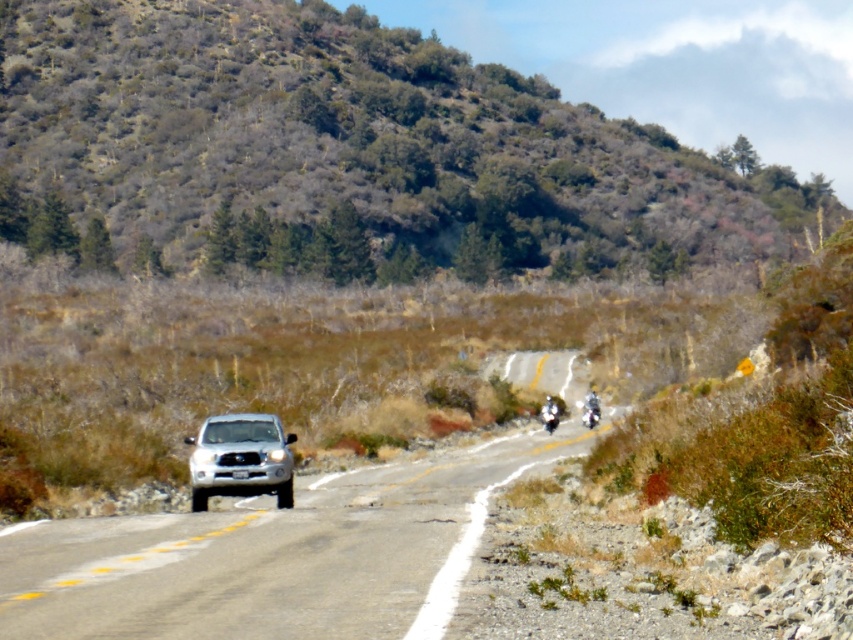
You are a cyclist approaching the road with two silver SUVs. You notice the silver metallic suv at center and the satin silver suv at center. Which SUV is positioned to the right of the other?

The silver metallic suv at center is to the right of the satin silver suv at center.